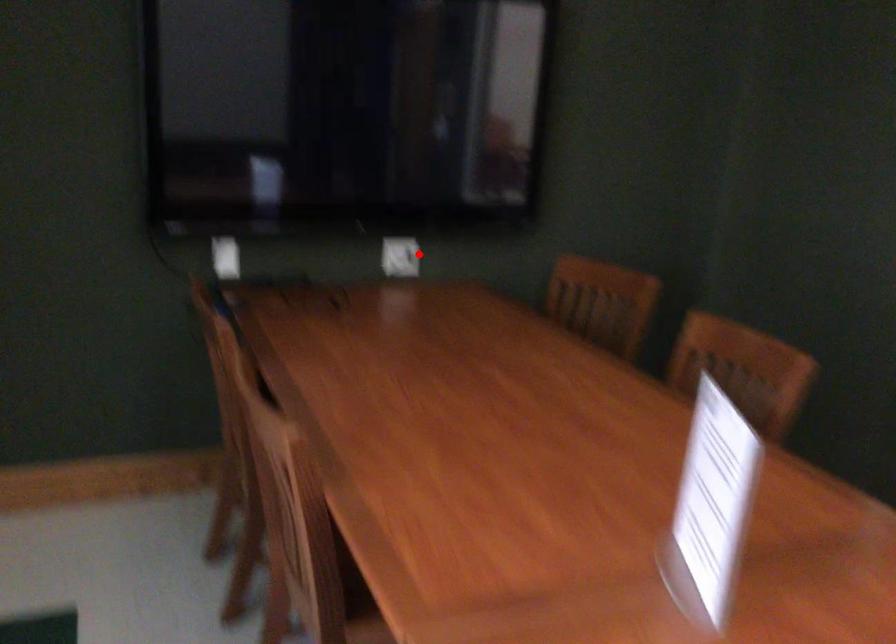
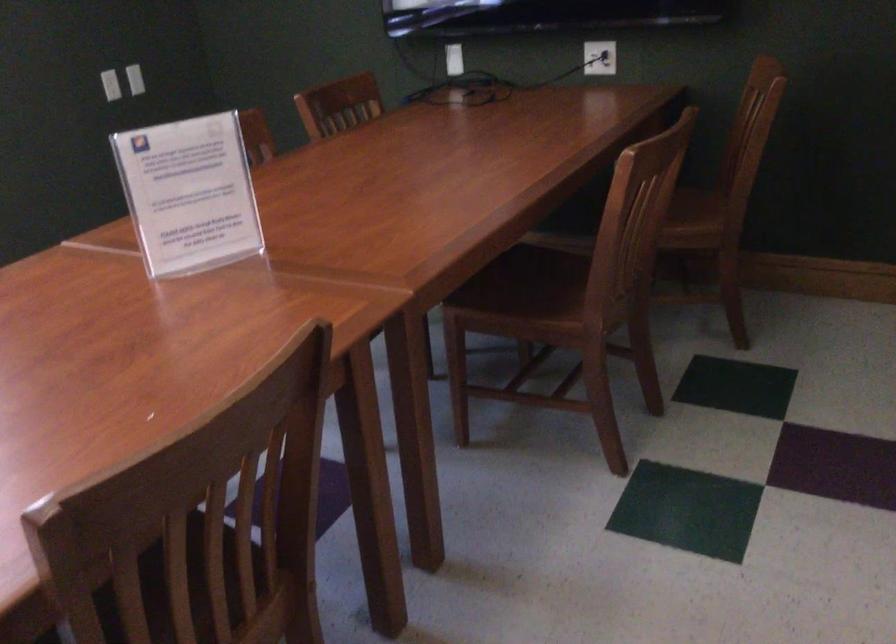
The point at the highlighted location is marked in the first image. Where is the corresponding point in the second image?

(599, 58)